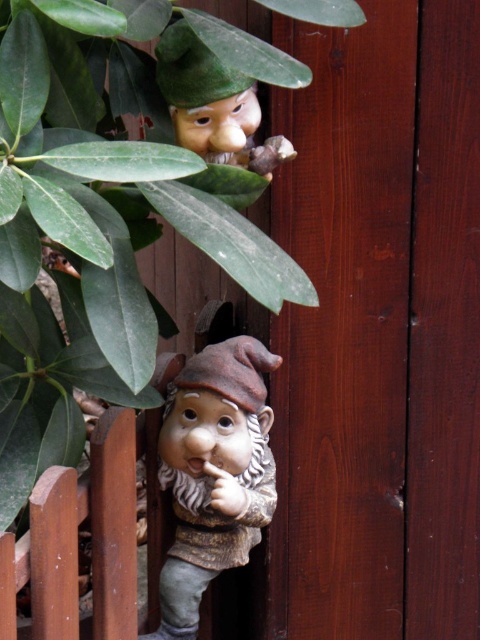
Question: Where is matte brown statue at center located in relation to matte green hat at upper center in the image?

Choices:
 (A) right
 (B) left

Answer: (B)

Question: Among these points, which one is farthest from the camera?

Choices:
 (A) (157, 48)
 (B) (229, 500)

Answer: (B)

Question: Among these objects, which one is nearest to the camera?

Choices:
 (A) matte green hat at upper center
 (B) matte brown statue at center

Answer: (A)

Question: Can you confirm if matte brown statue at center is bigger than matte green hat at upper center?

Choices:
 (A) yes
 (B) no

Answer: (A)

Question: Can you confirm if matte brown statue at center is positioned below matte green hat at upper center?

Choices:
 (A) yes
 (B) no

Answer: (A)